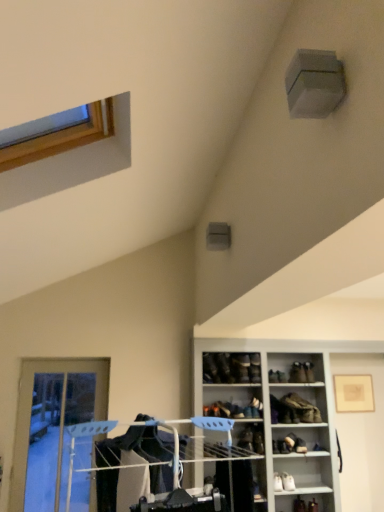
At what (x,y) coordinates should I click in order to perform the action: click on leather boot at center, the third footwear ordered from the bottom. Please return your answer as a coordinate pair (x, y). This screenshot has height=512, width=384. Looking at the image, I should click on 293,410.

What is the approximate height of leather shoe at upper right, the 4th shoe when ordered from left to right?

5.73 inches.

At what (x,y) coordinates should I click in order to perform the action: click on black leather shoe at center, the 4th shoe viewed from the right. Please return your answer as a coordinate pair (x, y). The image size is (384, 512). Looking at the image, I should click on (210, 369).

Identify the location of matte gold picture frame at upper right. (354, 393).

What do you see at coordinates (52, 425) in the screenshot? The height and width of the screenshot is (512, 384). I see `transparent glass door at lower left` at bounding box center [52, 425].

What is the approximate width of leather boot at lower right, which ranks as the second footwear in bottom-to-top order?

10.28 inches.

Where is `leather boot at lower right, which appears as the 2th footwear when viewed from the top`? The width and height of the screenshot is (384, 512). leather boot at lower right, which appears as the 2th footwear when viewed from the top is located at coordinates (289, 445).

Find the location of a particular element. The height and width of the screenshot is (512, 384). matte black shoe at upper center, which is the 1th shoe in top-to-bottom order is located at coordinates (x=224, y=367).

Consider the image. Could you tell me if matte black shoe at upper right, which is the 3th shoe from top to bottom, is turned towards transparent glass door at lower left?

No, matte black shoe at upper right, which is the 3th shoe from top to bottom, is not facing towards transparent glass door at lower left.

From a real-world perspective, is matte black shoe at upper right, the second shoe when ordered from bottom to top, over transparent glass door at lower left?

Yes, from a real-world perspective, matte black shoe at upper right, the second shoe when ordered from bottom to top, is on top of transparent glass door at lower left.

From the image's perspective, is matte black shoe at upper right, which is the 3th shoe from top to bottom, located above transparent glass door at lower left?

Yes.

Starting from the matte gold picture frame at upper right, which footwear is the 2nd one to the left? Please provide its 2D coordinates.

[(289, 445)]

Does leather boot at lower right, which appears as the 2th footwear when viewed from the top, have a lesser width compared to matte gold picture frame at upper right?

Incorrect, the width of leather boot at lower right, which appears as the 2th footwear when viewed from the top, is not less than that of matte gold picture frame at upper right.

From a real-world perspective, is leather boot at lower right, which ranks as the second footwear in bottom-to-top order, located beneath matte gold picture frame at upper right?

Yes.

Is leather boot at lower right, which appears as the 2th footwear when viewed from the top, located outside matte gold picture frame at upper right?

Indeed, leather boot at lower right, which appears as the 2th footwear when viewed from the top, is completely outside matte gold picture frame at upper right.

Considering the relative sizes of leather shoe at upper right, which is counted as the 4th shoe, starting from the top, and transparent glass door at lower left in the image provided, is leather shoe at upper right, which is counted as the 4th shoe, starting from the top, bigger than transparent glass door at lower left?

Actually, leather shoe at upper right, which is counted as the 4th shoe, starting from the top, might be smaller than transparent glass door at lower left.

From a real-world perspective, between leather shoe at upper right, the 1th shoe from the bottom, and transparent glass door at lower left, who is vertically lower?

In real-world perspective, leather shoe at upper right, the 1th shoe from the bottom, is lower.

Could you tell me if leather shoe at upper right, the 1th shoe from the bottom, is facing transparent glass door at lower left?

No.

From the image's perspective, which object appears higher, leather shoe at upper right, the 4th shoe when ordered from left to right, or transparent glass door at lower left?

transparent glass door at lower left.

Could you measure the distance between matte black shoe at upper right, the second shoe when ordered from bottom to top, and leather shoe at upper right, acting as the first shoe starting from the right?

matte black shoe at upper right, the second shoe when ordered from bottom to top, and leather shoe at upper right, acting as the first shoe starting from the right, are 22.60 inches apart from each other.

From the image's perspective, is matte black shoe at upper right, the 2th shoe viewed from the right, above leather shoe at upper right, the 4th shoe when ordered from left to right?

Indeed, from the image's perspective, matte black shoe at upper right, the 2th shoe viewed from the right, is shown above leather shoe at upper right, the 4th shoe when ordered from left to right.

In terms of height, does matte black shoe at upper right, placed as the 3th shoe when sorted from left to right, look taller or shorter compared to leather shoe at upper right, the 4th shoe when ordered from left to right?

matte black shoe at upper right, placed as the 3th shoe when sorted from left to right, is taller than leather shoe at upper right, the 4th shoe when ordered from left to right.

Considering the positions of objects matte black shoe at upper right, the 2th shoe viewed from the right, and leather shoe at upper right, the 1th shoe from the bottom, in the image provided, who is more to the left, matte black shoe at upper right, the 2th shoe viewed from the right, or leather shoe at upper right, the 1th shoe from the bottom,?

From the viewer's perspective, matte black shoe at upper right, the 2th shoe viewed from the right, appears more on the left side.

Consider the image. Based on their positions, is leather shoe at upper right, which is counted as the 4th shoe, starting from the top, located to the left or right of leather boot at lower right, which appears as the 2th footwear when viewed from the top?

Based on their positions, leather shoe at upper right, which is counted as the 4th shoe, starting from the top, is located to the right of leather boot at lower right, which appears as the 2th footwear when viewed from the top.

Is the depth of leather shoe at upper right, the 1th shoe from the bottom, greater than that of leather boot at lower right, which ranks as the second footwear in bottom-to-top order?

Yes, leather shoe at upper right, the 1th shoe from the bottom, is behind leather boot at lower right, which ranks as the second footwear in bottom-to-top order.

How different are the orientations of leather shoe at upper right, acting as the first shoe starting from the right, and leather boot at lower right, which ranks as the second footwear in bottom-to-top order, in degrees?

The facing directions of leather shoe at upper right, acting as the first shoe starting from the right, and leather boot at lower right, which ranks as the second footwear in bottom-to-top order, are 13.9 degrees apart.

Is point (303, 451) in front of point (292, 440)?

Yes, it is.

The height and width of the screenshot is (512, 384). In order to click on shoe that is the 2nd object to the right of the transparent glass door at lower left, starting at the anchor in this screenshot , I will do `click(224, 367)`.

Consider the image. Is transparent glass door at lower left located within matte black shoe at upper center, the 4th shoe ordered from the bottom?

Actually, transparent glass door at lower left is outside matte black shoe at upper center, the 4th shoe ordered from the bottom.

Between point (226, 357) and point (25, 401), which one is positioned behind?

The point (25, 401) is farther.

Which of these two, matte black shoe at upper center, the 4th shoe ordered from the bottom, or transparent glass door at lower left, is bigger?

With larger size is transparent glass door at lower left.

From the image's perspective, is leather shoe at upper right, acting as the first shoe starting from the right, located above or below black leather shoe at center, the 4th shoe viewed from the right?

leather shoe at upper right, acting as the first shoe starting from the right, is below black leather shoe at center, the 4th shoe viewed from the right.

Is leather shoe at upper right, acting as the first shoe starting from the right, directly adjacent to black leather shoe at center, the 1th shoe when ordered from left to right?

No.

Which is farther from the camera, (299, 440) or (220, 380)?

The point (220, 380) is farther.

You are a GUI agent. You are given a task and a screenshot of the screen. Output one action in this format:
    pyautogui.click(x=<x>, y=<y>)
    Task: Click on the 4th shoe behind when counting from the transparent glass door at lower left
    
    Given the screenshot: What is the action you would take?
    pyautogui.click(x=297, y=373)

You are a GUI agent. You are given a task and a screenshot of the screen. Output one action in this format:
    pyautogui.click(x=<x>, y=<y>)
    Task: Click on the picture frame lying on the right of leather boot at lower right, which appears as the 2th footwear when viewed from the top
    
    Given the screenshot: What is the action you would take?
    pyautogui.click(x=354, y=393)

Which object lies further to the anchor point matte black shoe at upper right, which is the 3th shoe from top to bottom, matte gold picture frame at upper right or leather boot at lower right, which ranks as the second footwear in bottom-to-top order?

matte gold picture frame at upper right.

When comparing their distances from leather shoe at upper right, the 1th shoe from the bottom, does leather boot at lower right, which appears as the 2th footwear when viewed from the top, or matte black shoe at upper center, the 4th shoe ordered from the bottom, seem closer?

leather boot at lower right, which appears as the 2th footwear when viewed from the top, is positioned closer to the anchor leather shoe at upper right, the 1th shoe from the bottom.

Estimate the real-world distances between objects in this image. Which object is closer to white glossy cabinet at lower right, white leather shoe at lower right, which is counted as the first footwear, starting from the bottom, or leather boot at lower right, which ranks as the second footwear in bottom-to-top order?

leather boot at lower right, which ranks as the second footwear in bottom-to-top order, lies closer to white glossy cabinet at lower right than the other object.

From the picture: From the image, which object appears to be farther from leather shoe at upper right, the 1th shoe from the bottom, leather boot at center, the third footwear ordered from the bottom, or matte black shoe at upper right, the second shoe when ordered from bottom to top?

The object further to leather shoe at upper right, the 1th shoe from the bottom, is matte black shoe at upper right, the second shoe when ordered from bottom to top.

Estimate the real-world distances between objects in this image. Which object is closer to white glossy cabinet at lower right, matte black shoe at upper center, the 4th shoe ordered from the bottom, or transparent glass door at lower left?

matte black shoe at upper center, the 4th shoe ordered from the bottom, is closer to white glossy cabinet at lower right.

From the image, which object appears to be nearer to leather boot at lower right, which ranks as the second footwear in bottom-to-top order, white leather shoe at lower right, which is counted as the first footwear, starting from the bottom, or matte gold picture frame at upper right?

white leather shoe at lower right, which is counted as the first footwear, starting from the bottom.

From the image, which object appears to be farther from matte black shoe at upper center, the 4th shoe ordered from the bottom, transparent glass door at lower left or matte black shoe at upper right, the 2th shoe viewed from the right?

transparent glass door at lower left.

Based on their spatial positions, is transparent glass door at lower left or black leather shoe at center, which is the 2th shoe in top-to-bottom order, further from white leather shoe at lower right, the 3th footwear positioned from the top?

transparent glass door at lower left is further to white leather shoe at lower right, the 3th footwear positioned from the top.

Locate an element on the screen. footwear between leather boot at center, the 1th footwear when ordered from top to bottom, and leather shoe at upper right, the 1th shoe from the bottom, in the vertical direction is located at coordinates (289, 445).

Identify the location of shoe that lies between white glossy cabinet at lower right and white leather shoe at lower right, the 3th footwear positioned from the top, from top to bottom. (300, 446).

Identify the location of picture frame between matte black shoe at upper right, which is the 3th shoe from top to bottom, and white leather shoe at lower right, which is counted as the first footwear, starting from the bottom, vertically. The height and width of the screenshot is (512, 384). (354, 393).

Locate an element on the screen. The height and width of the screenshot is (512, 384). cabinetry between leather boot at center, the third footwear ordered from the bottom, and white leather shoe at lower right, the 3th footwear positioned from the top, vertically is located at coordinates (273, 423).